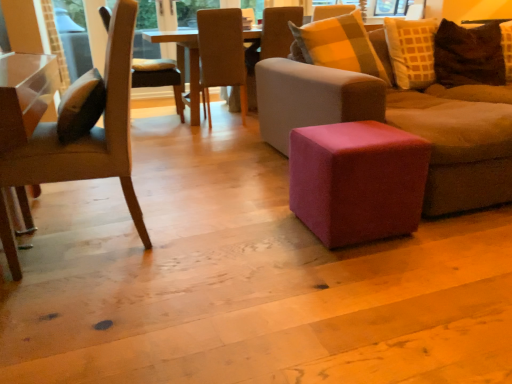
You are a GUI agent. You are given a task and a screenshot of the screen. Output one action in this format:
    pyautogui.click(x=<x>, y=<y>)
    Task: Click on the unoccupied area in front of pink fabric stool at center
    
    Given the screenshot: What is the action you would take?
    pyautogui.click(x=358, y=273)